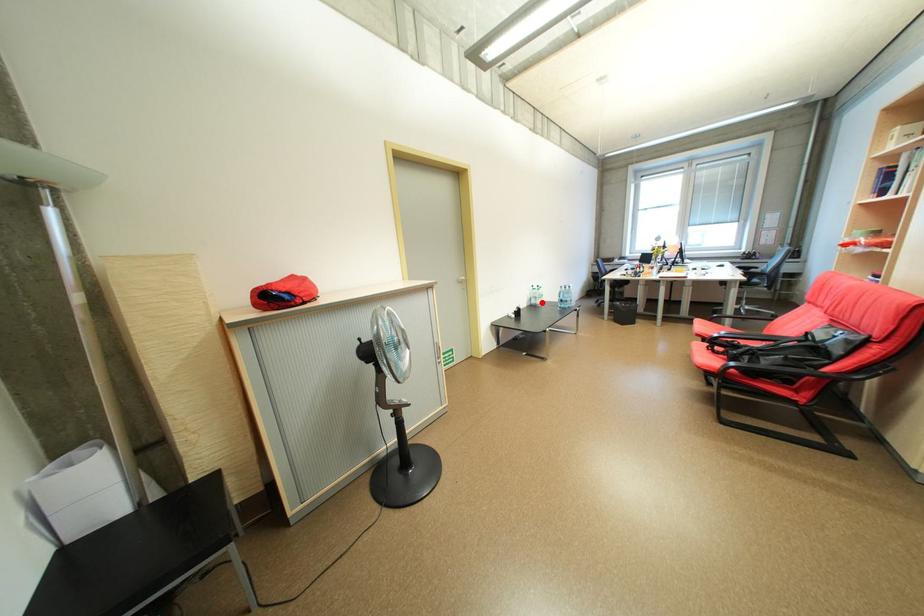
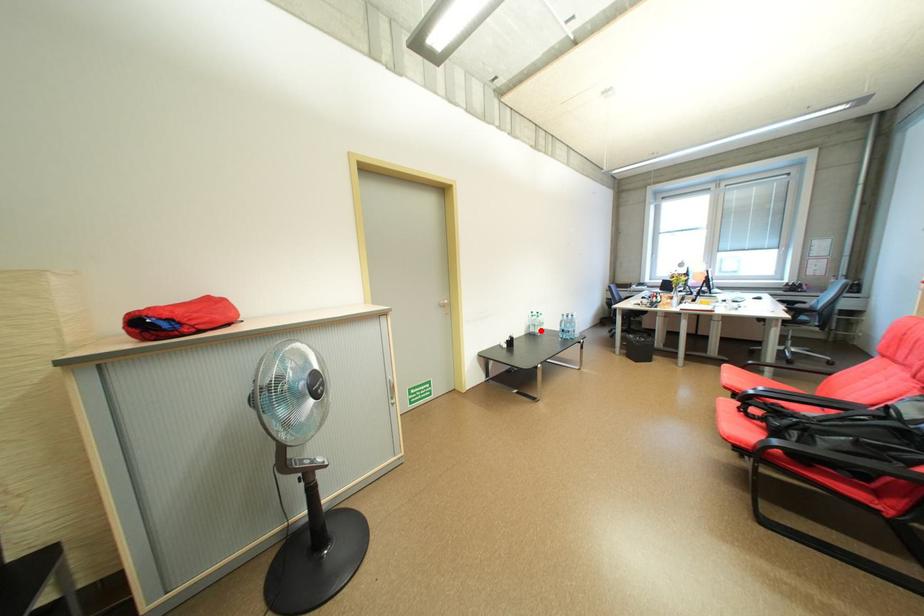
I am providing you with two images of the same scene from different viewpoints. A red point is marked on the first image and another point is marked on the second image. Is the marked point in image1 the same physical position as the marked point in image2?

Yes